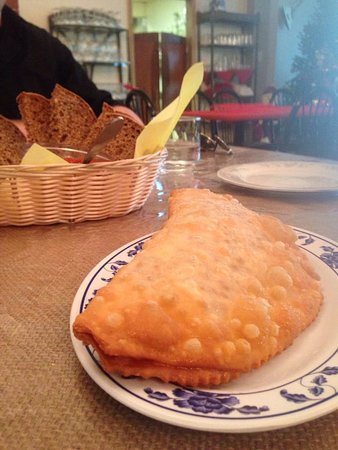
This screenshot has height=450, width=338. In order to click on napkin in this screenshot , I will do `click(146, 133)`.